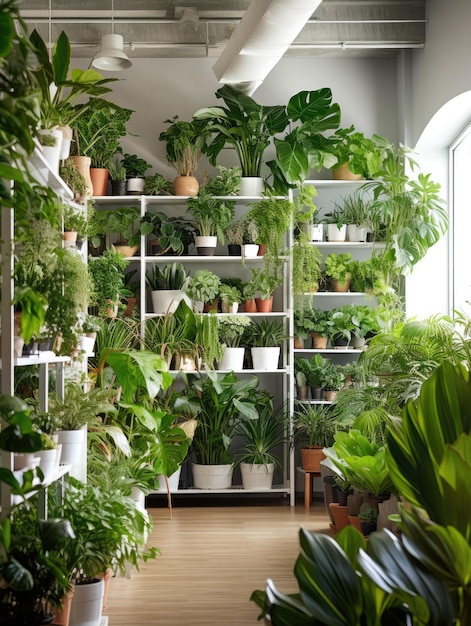
Identify the location of red clay pot. The image size is (471, 626). (310, 461).